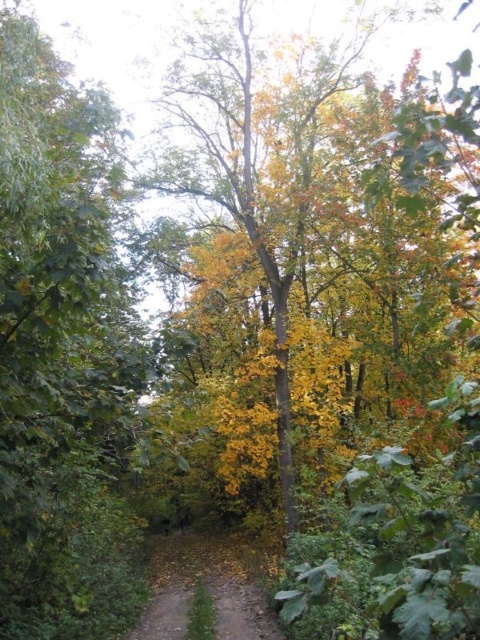
Question: Is green leafy tree at left smaller than brown dirt path at center?

Choices:
 (A) yes
 (B) no

Answer: (B)

Question: Where is green leafy tree at left located in relation to brown dirt path at center in the image?

Choices:
 (A) right
 (B) left

Answer: (B)

Question: Can you confirm if green leafy tree at left is wider than brown dirt path at center?

Choices:
 (A) yes
 (B) no

Answer: (B)

Question: Which point is closer to the camera?

Choices:
 (A) brown dirt path at center
 (B) green leafy tree at left

Answer: (B)